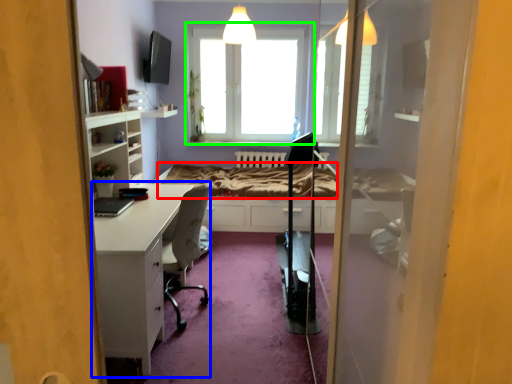
Question: Which object is the closest to the bed frame (highlighted by a red box)? Choose among these: desk (highlighted by a blue box) or window (highlighted by a green box).

Choices:
 (A) desk
 (B) window

Answer: (B)